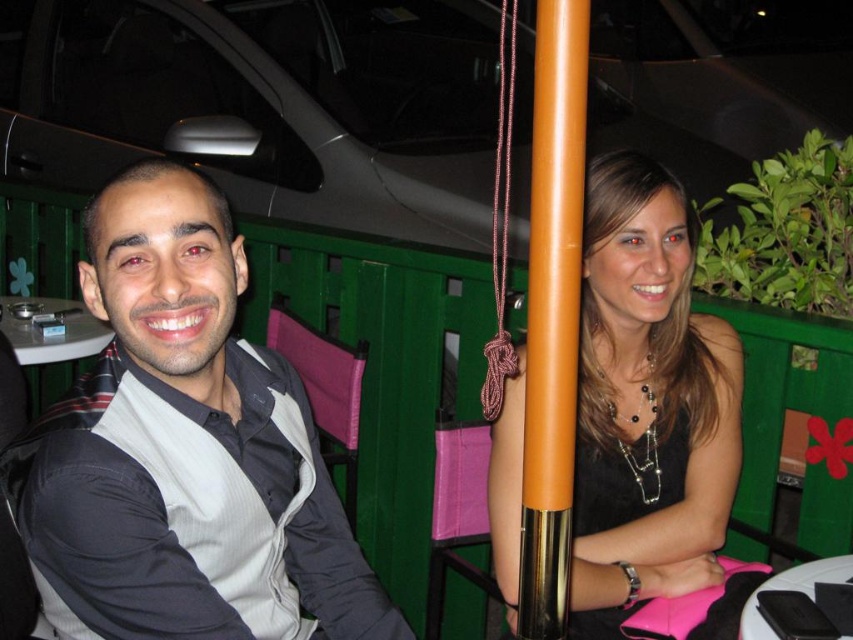
You are a photographer setting up a shot at this outdoor cafe scene. You need to place a small reflector between the orange glossy pole at center and the white glossy table at lower left. Based on their positions, which object should the reflector be closer to?

The orange glossy pole at center is positioned on the right side of white glossy table at lower left, so the reflector should be placed closer to the white glossy table at lower left.

From the picture: You are a tailor measuring for a custom suit. You observe the gray fabric shirt at left and the white glossy table at lower left. Which object has a greater width?

The gray fabric shirt at left has a greater width than the white glossy table at lower left.

You are a photographer setting up for a portrait. You need to ensure that the gray fabric shirt at left and the black satin dress at center are both visible in the frame. Based on their positions, which one is lower in the image?

The gray fabric shirt at left is positioned under the black satin dress at center, so it is lower in the image.